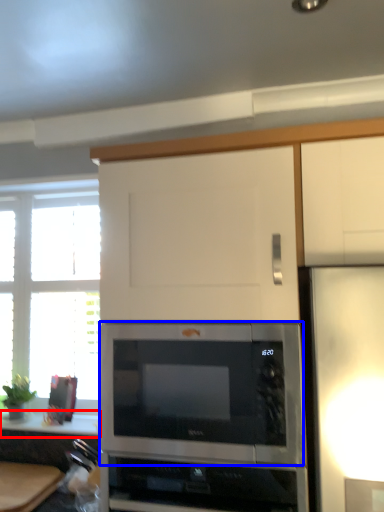
Question: Which object appears closest to the camera in this image, counter top (highlighted by a red box) or microwave oven (highlighted by a blue box)?

Choices:
 (A) counter top
 (B) microwave oven

Answer: (B)